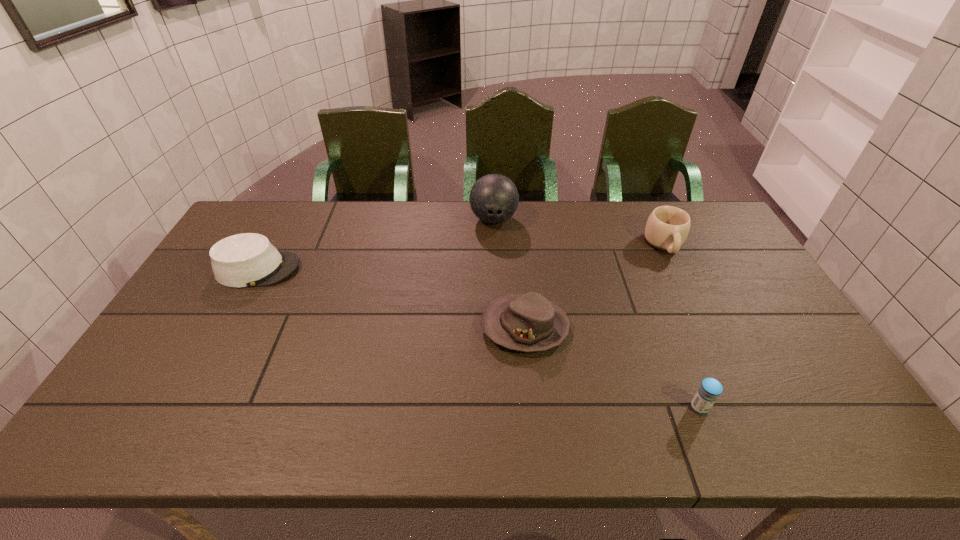
Identify the location of vacant space that satisfies the following two spatial constraints: 1. on the grip area of the fourth object from left to right; 2. on the left side of the bowling ball. The width and height of the screenshot is (960, 540). (501, 408).

At what (x,y) coordinates should I click in order to perform the action: click on free location that satisfies the following two spatial constraints: 1. on the back side of the medicine; 2. on the front-facing side of the farther hat. Please return your answer as a coordinate pair (x, y). The image size is (960, 540). Looking at the image, I should click on (643, 269).

I want to click on vacant area that satisfies the following two spatial constraints: 1. on the grip area of the medicine; 2. on the left side of the bowling ball, so click(x=501, y=408).

This screenshot has width=960, height=540. I want to click on vacant area that satisfies the following two spatial constraints: 1. on the decorative side of the right hat; 2. on the back side of the medicine, so click(x=533, y=408).

You are a GUI agent. You are given a task and a screenshot of the screen. Output one action in this format:
    pyautogui.click(x=<x>, y=<y>)
    Task: Click on the vacant space that satisfies the following two spatial constraints: 1. on the front-facing side of the farther hat; 2. on the back side of the medicine
    The height and width of the screenshot is (540, 960).
    Given the screenshot: What is the action you would take?
    pyautogui.click(x=181, y=408)

At what (x,y) coordinates should I click in order to perform the action: click on free space that satisfies the following two spatial constraints: 1. on the grip area of the bowling ball; 2. on the front-facing side of the farther hat. Please return your answer as a coordinate pair (x, y). Looking at the image, I should click on (495, 269).

At what (x,y) coordinates should I click in order to perform the action: click on vacant area in the image that satisfies the following two spatial constraints: 1. on the decorative side of the medicine; 2. on the left side of the right hat. Please return your answer as a coordinate pair (x, y). This screenshot has height=540, width=960. Looking at the image, I should click on (533, 408).

Identify the location of vacant space that satisfies the following two spatial constraints: 1. on the side of the mug with the handle; 2. on the front-facing side of the leftmost object. The width and height of the screenshot is (960, 540). (677, 269).